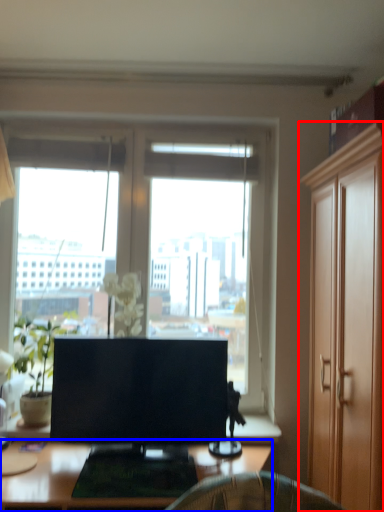
Question: Among these objects, which one is farthest to the camera, cabinetry (highlighted by a red box) or desk (highlighted by a blue box)?

Choices:
 (A) cabinetry
 (B) desk

Answer: (B)